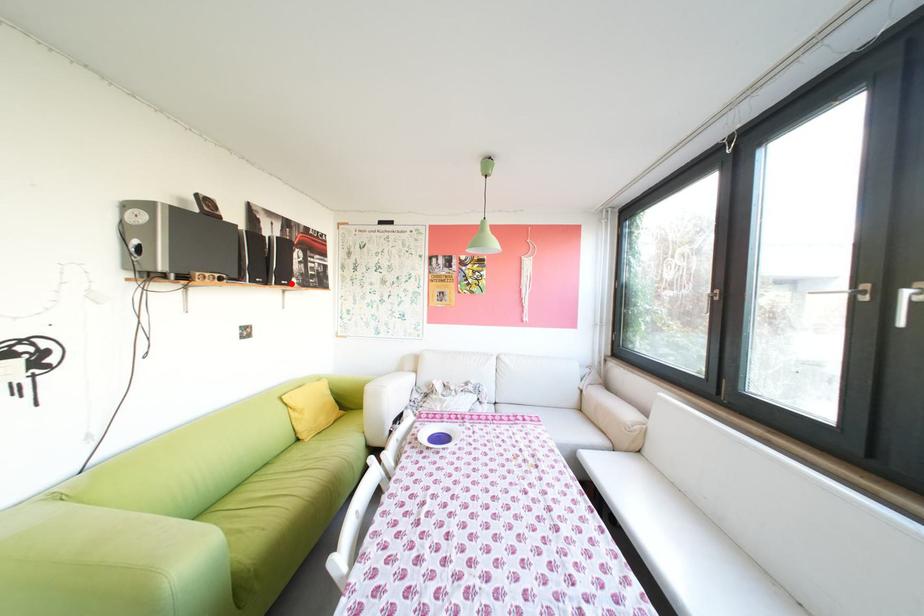
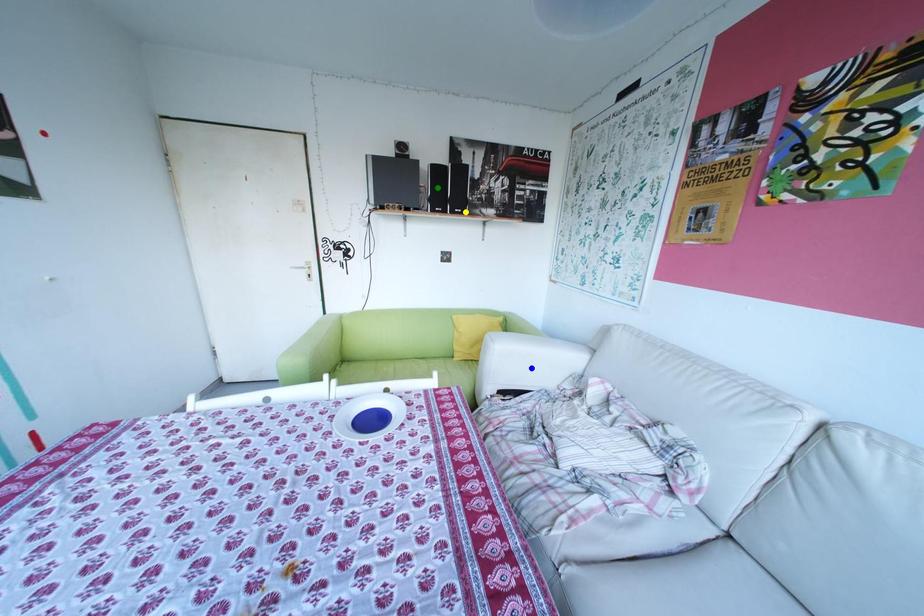
Question: I am providing you with two images of the same scene from different viewpoints. A red point is marked on the first image. You are given multiple points on the second image. In image 2, which mark is for the same physical point as the one in image 1?

Choices:
 (A) blue point
 (B) yellow point
 (C) green point

Answer: (B)